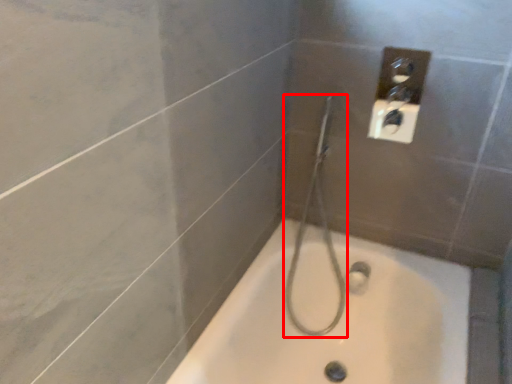
Question: From the image's perspective, where is shower (annotated by the red box) located in relation to bathtub in the image?

Choices:
 (A) below
 (B) above

Answer: (B)